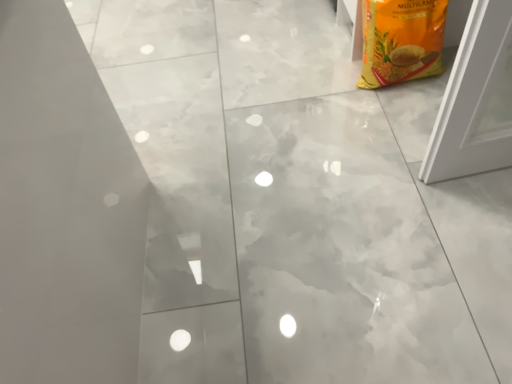
This screenshot has height=384, width=512. In order to click on yellow matte grocery bag at upper right in this screenshot , I will do `click(401, 40)`.

The image size is (512, 384). Describe the element at coordinates (401, 40) in the screenshot. I see `yellow matte grocery bag at upper right` at that location.

Where is `yellow matte grocery bag at upper right`? The image size is (512, 384). yellow matte grocery bag at upper right is located at coordinates (401, 40).